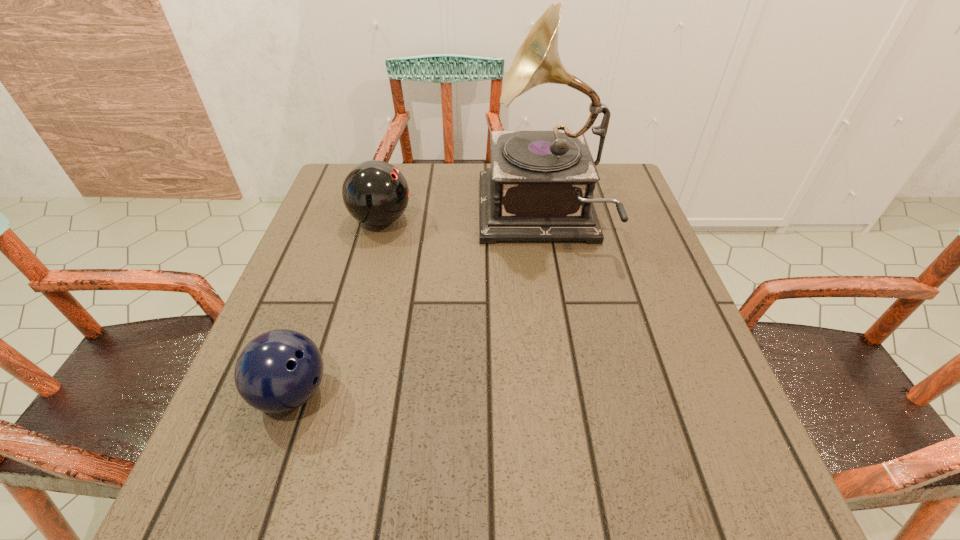
This screenshot has height=540, width=960. Find the location of `free space between the second tallest object and the record player`. free space between the second tallest object and the record player is located at coordinates (461, 218).

Identify the location of free point between the second tallest object and the record player. (461, 218).

This screenshot has width=960, height=540. Find the location of `the second closest object to the shorter bowling ball`. the second closest object to the shorter bowling ball is located at coordinates (540, 186).

Identify which object is the closest to the rightmost object. Please provide its 2D coordinates. Your answer should be formatted as a tuple, i.e. [(x, y)], where the tuple contains the x and y coordinates of a point satisfying the conditions above.

[(375, 193)]